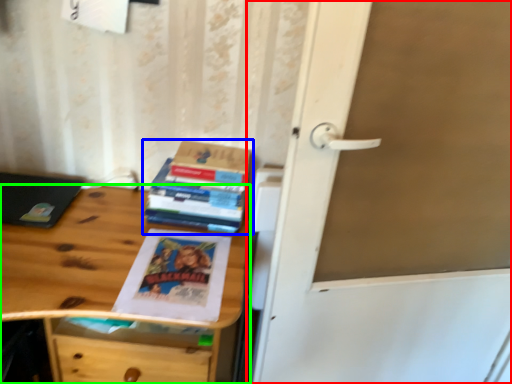
Question: Estimate the real-world distances between objects in this image. Which object is closer to door (highlighted by a red box), book (highlighted by a blue box) or desk (highlighted by a green box)?

Choices:
 (A) book
 (B) desk

Answer: (A)